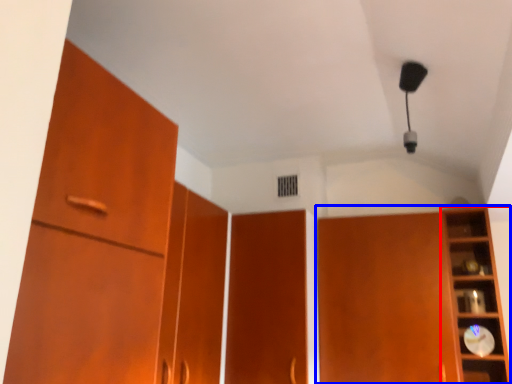
Question: Which object is further to the camera taking this photo, shelf (highlighted by a red box) or cupboard (highlighted by a blue box)?

Choices:
 (A) shelf
 (B) cupboard

Answer: (B)